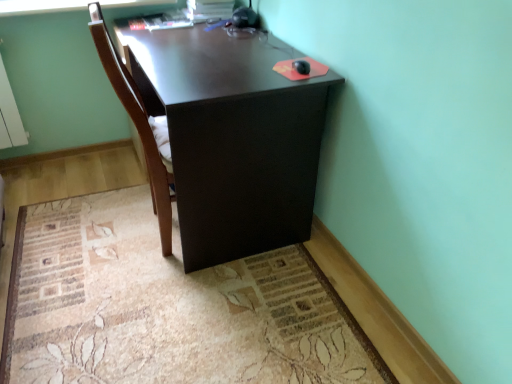
The height and width of the screenshot is (384, 512). What are the coordinates of `free space above beige carpet at lower center (from a real-world perspective)` in the screenshot? It's located at (172, 288).